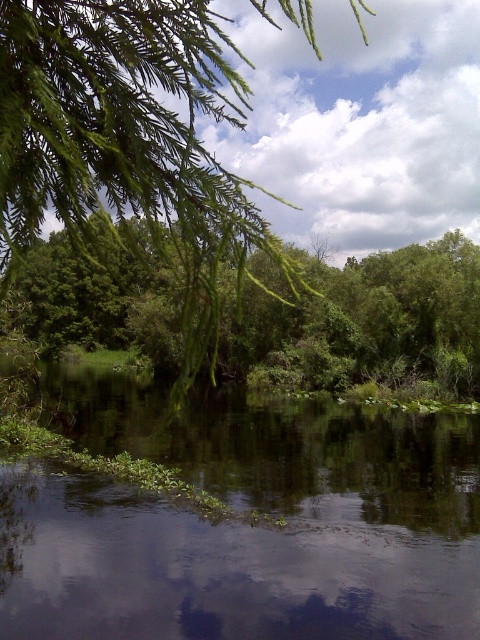
Question: Is green leafy vegetation at center behind green leafy branch at upper left?

Choices:
 (A) yes
 (B) no

Answer: (A)

Question: Among these objects, which one is farthest from the camera?

Choices:
 (A) green leafy vegetation at center
 (B) green leafy branch at upper left
 (C) green leafy tree at center

Answer: (A)

Question: Which object appears closest to the camera in this image?

Choices:
 (A) green leafy branch at upper left
 (B) green leafy tree at center

Answer: (A)

Question: Does green leafy vegetation at center come in front of green leafy tree at center?

Choices:
 (A) no
 (B) yes

Answer: (A)

Question: Which point is closer to the camera?

Choices:
 (A) (200, 612)
 (B) (9, 109)
 (C) (456, 348)

Answer: (B)

Question: Is the position of green leafy vegetation at center more distant than that of green leafy tree at center?

Choices:
 (A) yes
 (B) no

Answer: (A)